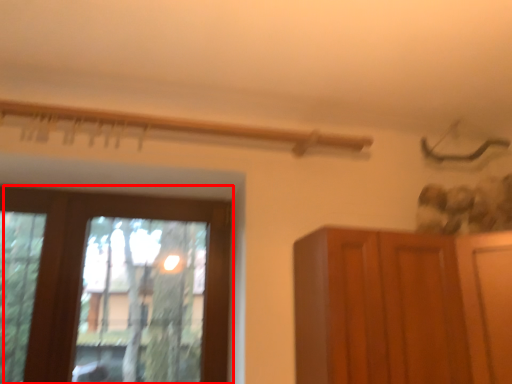
Question: Where is window (annotated by the red box) located in relation to cupboard in the image?

Choices:
 (A) left
 (B) right

Answer: (A)